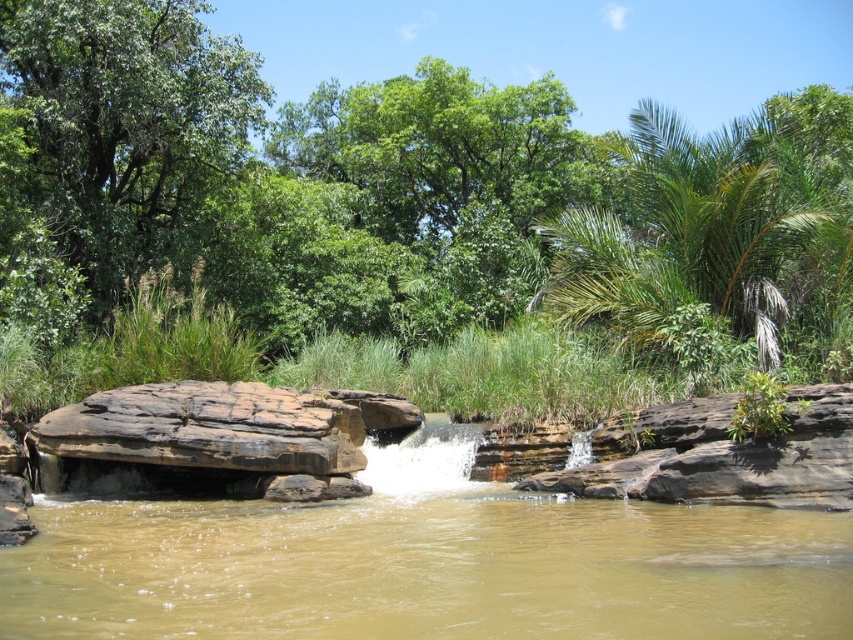
Question: From the image, what is the correct spatial relationship of brown sedimentary rock at center in relation to green leafy palm at upper right?

Choices:
 (A) right
 (B) left

Answer: (B)

Question: Which point is closer to the camera taking this photo?

Choices:
 (A) (248, 92)
 (B) (86, 531)
 (C) (299, 259)
 (D) (813, 330)

Answer: (B)

Question: Does green leafy tree at center have a smaller size compared to brown rough rock at center?

Choices:
 (A) no
 (B) yes

Answer: (A)

Question: Is green leafy tree at center positioned before brown rough rock at center?

Choices:
 (A) no
 (B) yes

Answer: (A)

Question: Which point is farther from the camera taking this photo?

Choices:
 (A) (12, 163)
 (B) (572, 230)
 (C) (579, 529)
 (D) (257, 131)

Answer: (D)

Question: Which of the following is the farthest from the observer?

Choices:
 (A) (76, 122)
 (B) (126, 211)
 (C) (337, 467)

Answer: (B)